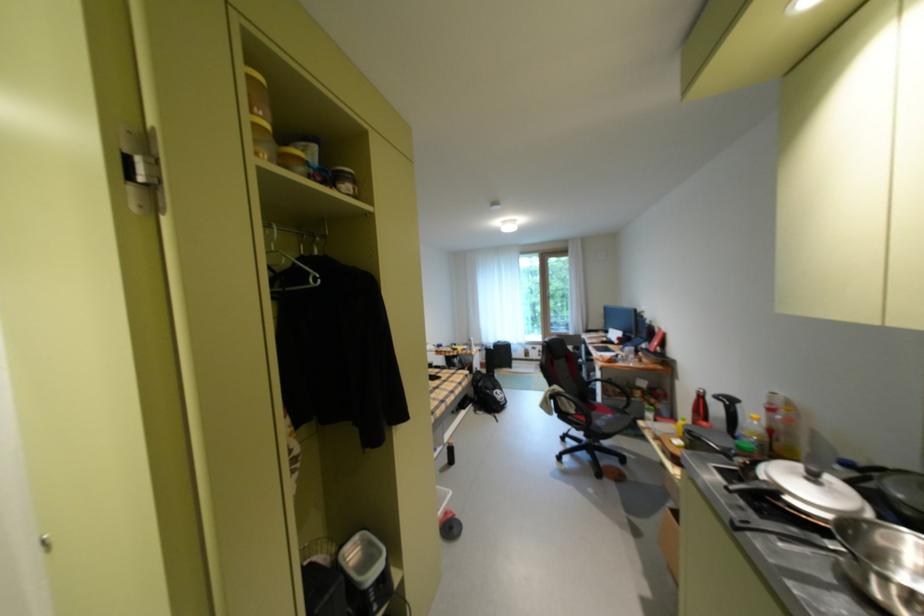
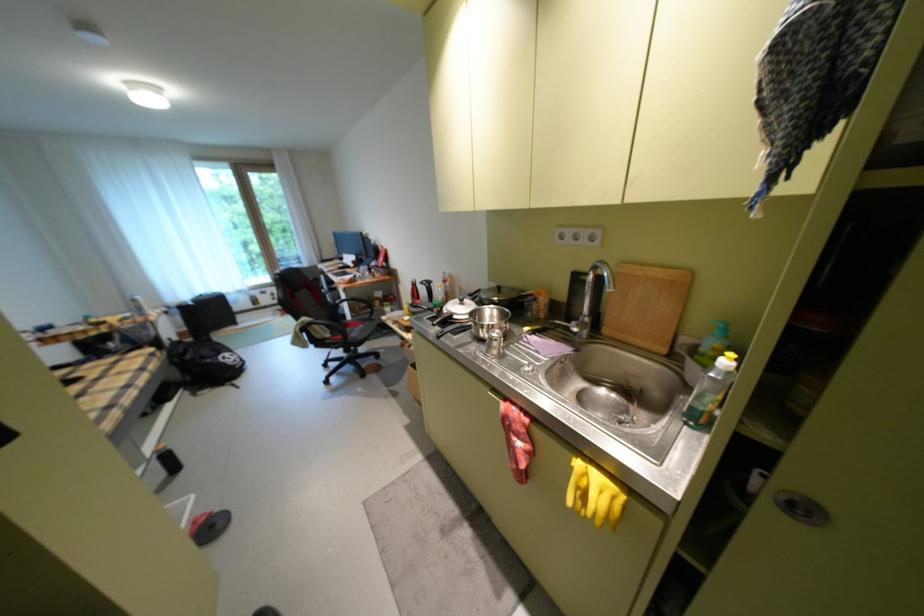
Locate, in the second image, the point that corresponds to (609,400) in the first image.

(359, 318)